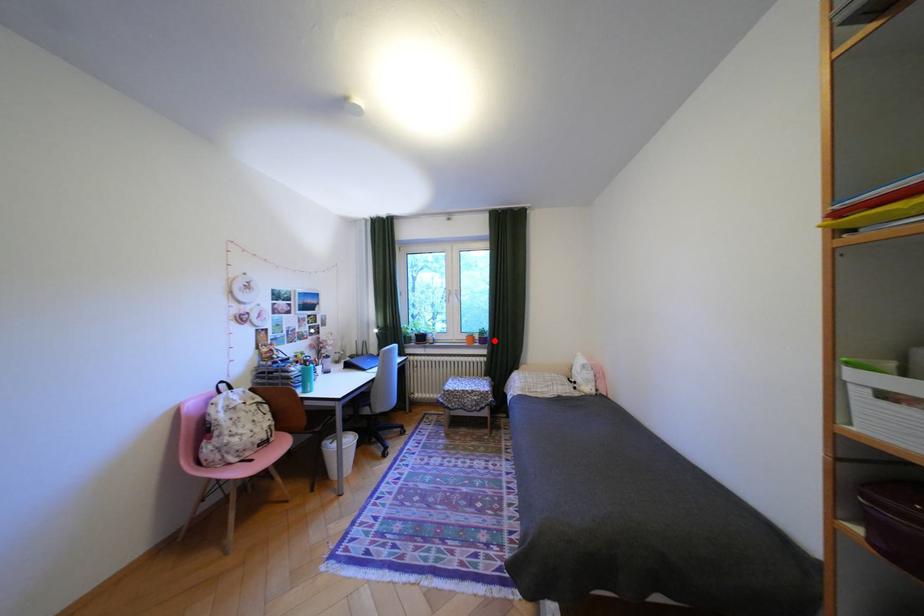
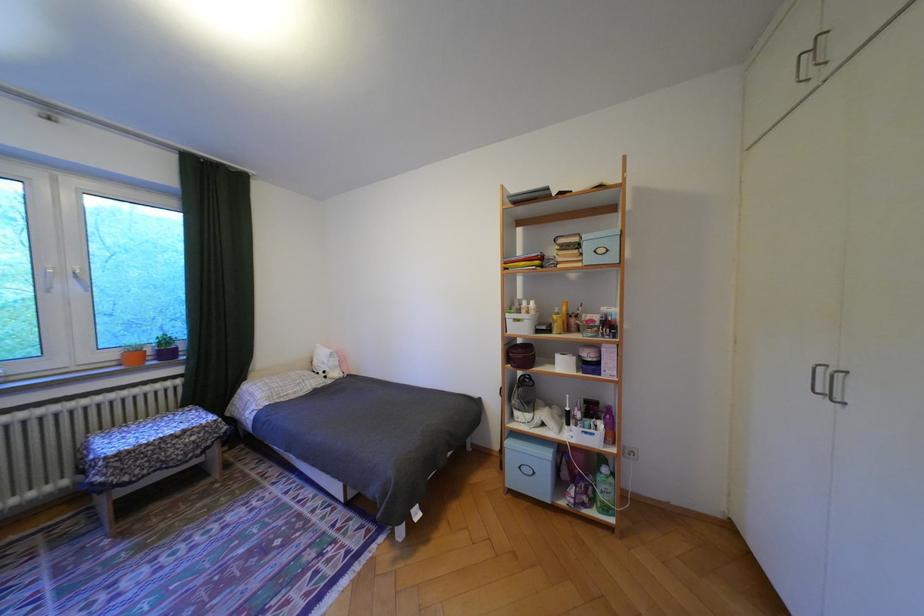
Question: I am providing you with two images of the same scene from different viewpoints. A red point is shown in image1. For the corresponding object point in image2, is it positioned nearer or farther from the camera?

Choices:
 (A) Nearer
 (B) Farther

Answer: (A)